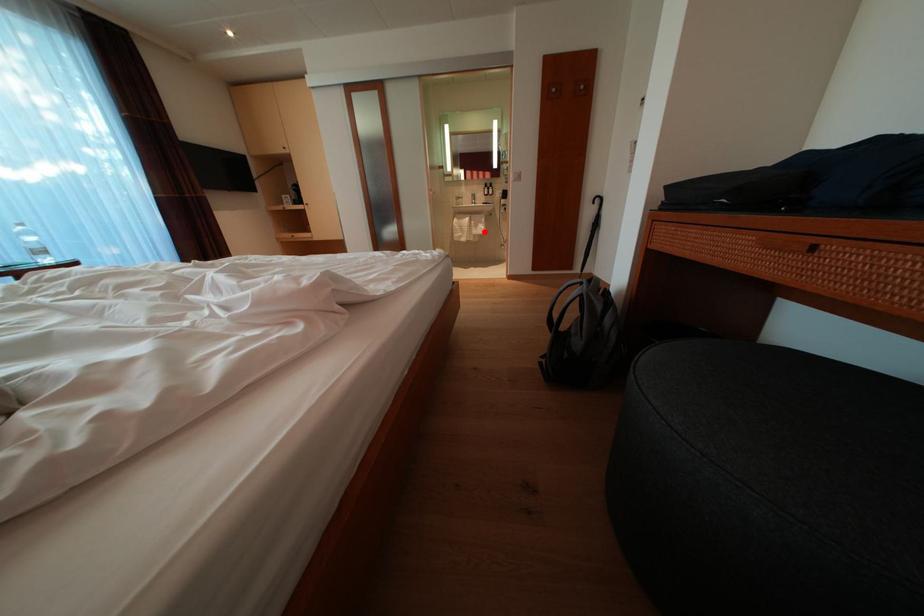
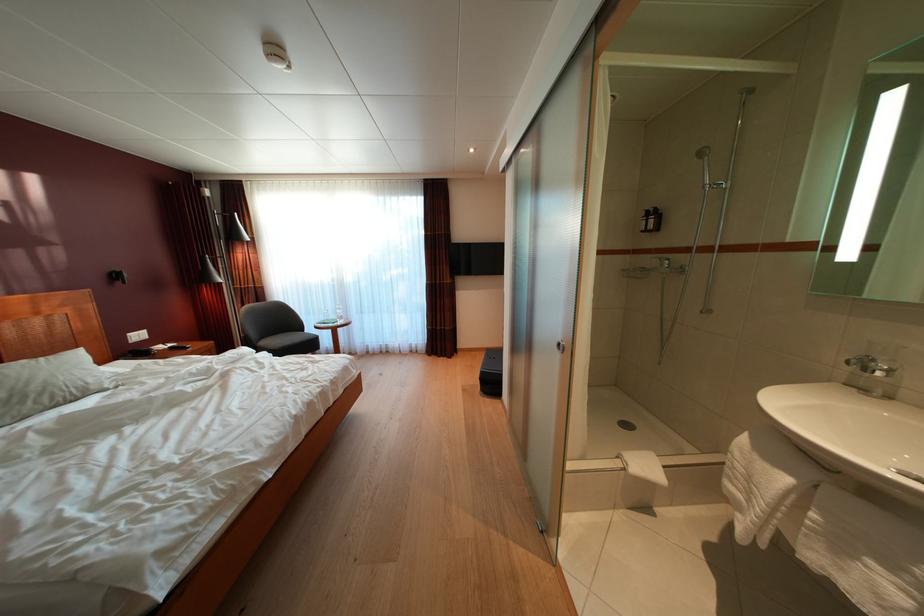
The point at the highlighted location is marked in the first image. Where is the corresponding point in the second image?

(849, 554)